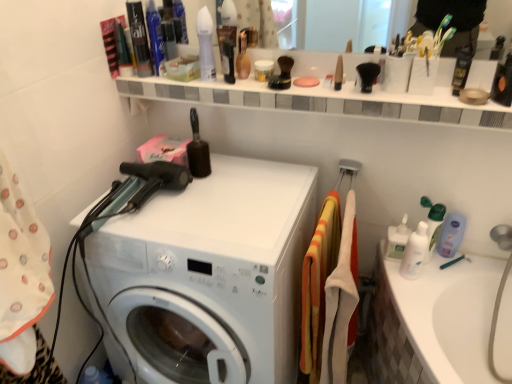
Question: Is white matte jar at upper center, placed as the 4th toiletry when sorted from bottom to top, in front of or behind black matte hair gel at upper right, positioned as the sixth toiletry in top-to-bottom order, in the image?

Choices:
 (A) front
 (B) behind

Answer: (B)

Question: Is point (256, 62) closer or farther from the camera than point (473, 49)?

Choices:
 (A) closer
 (B) farther

Answer: (A)

Question: Considering the real-world distances, which object is farthest from the matte plastic toothbrush at upper center, the 5th toiletry in the top-to-bottom sequence?

Choices:
 (A) black matte hair gel at upper right, the 2th toiletry ordered from the bottom
 (B) white matte jar at upper center, placed as the 4th toiletry when sorted from bottom to top
 (C) white plastic washing machine at center
 (D) clear plastic bottle at right, placed as the second cleaning product when sorted from left to right
 (E) orange/yellow striped towel at center, the first material in the left-to-right sequence

Answer: (A)

Question: Based on their relative distances, which object is farther from the clear plastic bottle at right, which appears as the 1th cleaning product when viewed from the right?

Choices:
 (A) shiny plastic hair spray at upper left, the 1th toiletry viewed from the left
 (B) white glossy shelf at upper center
 (C) white fabric at center, which is the 2th material in left-to-right order
 (D) white matte jar at upper center, which appears as the 4th toiletry when viewed from the top
 (E) shiny blue bottle at upper left, which is the 6th toiletry in right-to-left order

Answer: (A)